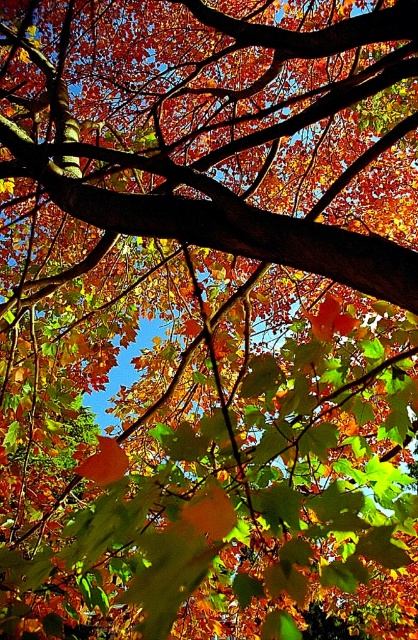
Does smooth brown branch at center have a greater height compared to orange matte maple leaf at center?

Yes.

Describe the element at coordinates (224, 224) in the screenshot. I see `smooth brown branch at center` at that location.

I want to click on smooth brown branch at center, so click(x=224, y=224).